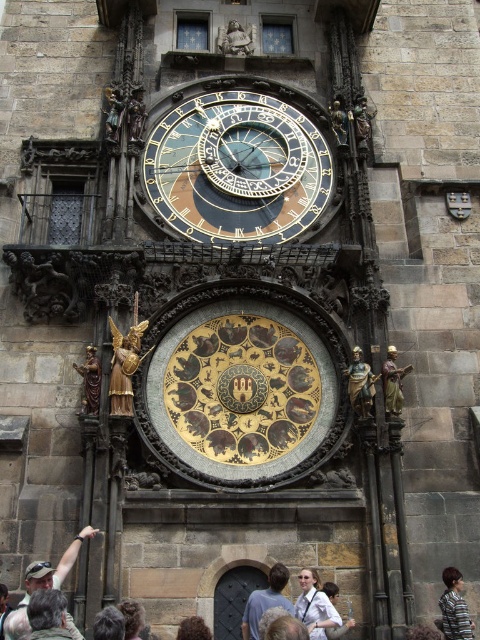
Which is more to the left, gold/brass/decorativeclock at center or gold polished statue at right?

gold/brass/decorativeclock at center

Is gold/brass/decorativeclock at center bigger than gold polished statue at right?

Yes, gold/brass/decorativeclock at center is bigger than gold polished statue at right.

What do you see at coordinates (242, 387) in the screenshot?
I see `gold/brass/decorativeclock at center` at bounding box center [242, 387].

I want to click on gold/brass/decorativeclock at center, so click(242, 387).

Can you confirm if bronze statue at center is wider than dark brown hair at lower center?

Yes.

Is bronze statue at center to the right of dark brown hair at lower center from the viewer's perspective?

Indeed, bronze statue at center is positioned on the right side of dark brown hair at lower center.

Locate an element on the screen. This screenshot has width=480, height=640. bronze statue at center is located at coordinates (360, 384).

At what (x,y) coordinates should I click in order to perform the action: click on bronze statue at center. Please return your answer as a coordinate pair (x, y). The height and width of the screenshot is (640, 480). Looking at the image, I should click on (360, 384).

Which is more to the left, striped fabric shirt at lower right or dark brown hair at lower center?

dark brown hair at lower center is more to the left.

Between striped fabric shirt at lower right and dark brown hair at lower center, which one has more height?

With more height is striped fabric shirt at lower right.

Does point (455, 596) come farther from viewer compared to point (189, 636)?

Yes.

In order to click on striped fabric shirt at lower right in this screenshot , I will do `click(455, 608)`.